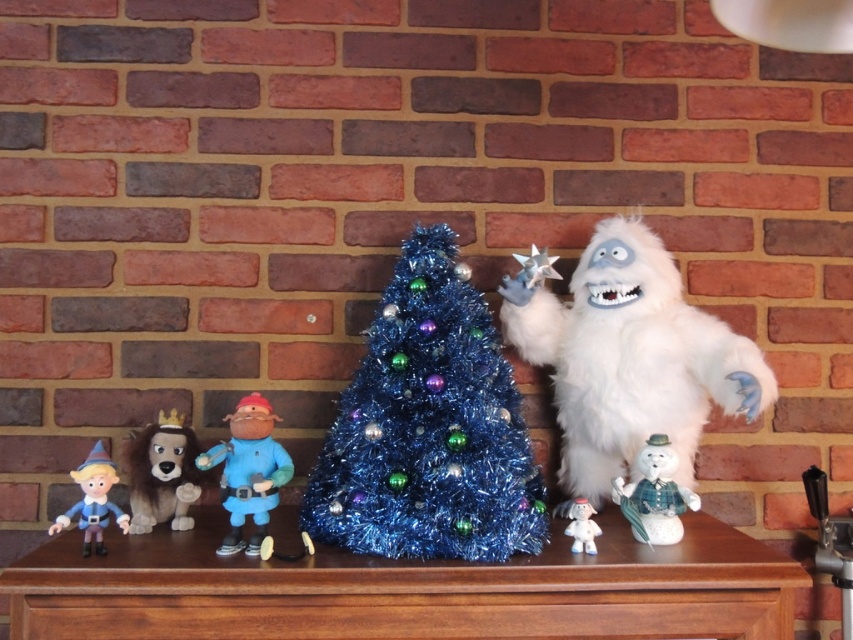
Locate an element on the screen. white fluffy ghost at right is located at coordinates (630, 356).

This screenshot has width=853, height=640. What are the coordinates of `white fluffy ghost at right` in the screenshot? It's located at (630, 356).

Does brown wooden table at center have a larger size compared to white fluffy doll at lower center?

Correct, brown wooden table at center is larger in size than white fluffy doll at lower center.

Image resolution: width=853 pixels, height=640 pixels. Find the location of `brown wooden table at center`. brown wooden table at center is located at coordinates (405, 589).

You are a GUI agent. You are given a task and a screenshot of the screen. Output one action in this format:
    pyautogui.click(x=<x>, y=<y>)
    Task: Click on the brown wooden table at center
    
    Given the screenshot: What is the action you would take?
    pyautogui.click(x=405, y=589)

From the picture: Does blue matte figure at center have a smaller size compared to white fluffy doll at lower center?

No, blue matte figure at center is not smaller than white fluffy doll at lower center.

Does point (250, 444) come farther from viewer compared to point (592, 531)?

Yes, it is behind point (592, 531).

This screenshot has width=853, height=640. In order to click on blue matte figure at center in this screenshot , I will do `click(248, 472)`.